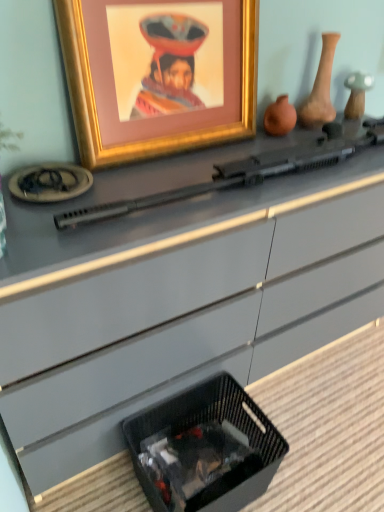
Question: From a real-world perspective, is gold-framed picture at upper center under black woven basket at lower center?

Choices:
 (A) no
 (B) yes

Answer: (A)

Question: Is gold-framed picture at upper center wider than black woven basket at lower center?

Choices:
 (A) yes
 (B) no

Answer: (B)

Question: Is gold-framed picture at upper center shorter than black woven basket at lower center?

Choices:
 (A) yes
 (B) no

Answer: (B)

Question: From a real-world perspective, is gold-framed picture at upper center on black woven basket at lower center?

Choices:
 (A) no
 (B) yes

Answer: (B)

Question: Is gold-framed picture at upper center behind black woven basket at lower center?

Choices:
 (A) no
 (B) yes

Answer: (A)

Question: Considering the positions of gold-framed picture at upper center and matte clay vase at upper right, placed as the second vase when sorted from left to right, in the image, is gold-framed picture at upper center wider or thinner than matte clay vase at upper right, placed as the second vase when sorted from left to right,?

Choices:
 (A) wide
 (B) thin

Answer: (B)

Question: From their relative heights in the image, would you say gold-framed picture at upper center is taller or shorter than matte clay vase at upper right, placed as the second vase when sorted from left to right?

Choices:
 (A) tall
 (B) short

Answer: (A)

Question: Considering their positions, is gold-framed picture at upper center located in front of or behind matte clay vase at upper right, the first vase from the right?

Choices:
 (A) behind
 (B) front

Answer: (B)

Question: Looking at the image, does gold-framed picture at upper center seem bigger or smaller compared to matte clay vase at upper right, the first vase from the right?

Choices:
 (A) small
 (B) big

Answer: (B)

Question: From the image's perspective, is black woven basket at lower center positioned above or below matte clay vase at upper right, placed as the second vase when sorted from left to right?

Choices:
 (A) below
 (B) above

Answer: (A)

Question: Is point (233, 498) positioned closer to the camera than point (299, 122)?

Choices:
 (A) farther
 (B) closer

Answer: (B)

Question: Considering their positions, is black woven basket at lower center located in front of or behind matte clay vase at upper right, placed as the second vase when sorted from left to right?

Choices:
 (A) front
 (B) behind

Answer: (A)

Question: Is black woven basket at lower center bigger or smaller than matte clay vase at upper right, the first vase from the right?

Choices:
 (A) big
 (B) small

Answer: (A)

Question: Considering their positions, is matte clay vase at upper right, placed as the second vase when sorted from left to right, located in front of or behind matte clay vase at upper center, which is the second vase in right-to-left order?

Choices:
 (A) behind
 (B) front

Answer: (B)

Question: From the image's perspective, is matte clay vase at upper right, the first vase from the right, above or below matte clay vase at upper center, which is the second vase in right-to-left order?

Choices:
 (A) above
 (B) below

Answer: (A)